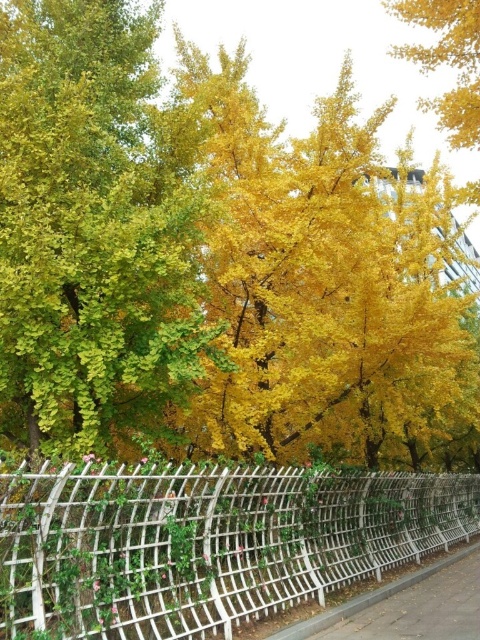
You are standing in the autumn scene and want to take a photo. You notice two points marked as point 1 at coordinates point (7,381) and point 2 at coordinates point (348,486). Which point is closer to you?

Point (7,381) is closer to the camera than point (348,486), so point 1 is closer to you.

You are standing in the autumn scene and want to place a small decoration between the two points, point [358,573] and point [322,616]. To ensure the decoration is visible from your current position, which point should you place it closer to?

You should place the decoration closer to point [322,616] because point [358,573] is behind point [322,616], so placing it near the closer point will ensure better visibility from your current position.

You are standing on the gray concrete pavement at lower center and looking up at the golden yellow leaves at center. Which object is taller?

The golden yellow leaves at center is taller than the gray concrete pavement at lower center.